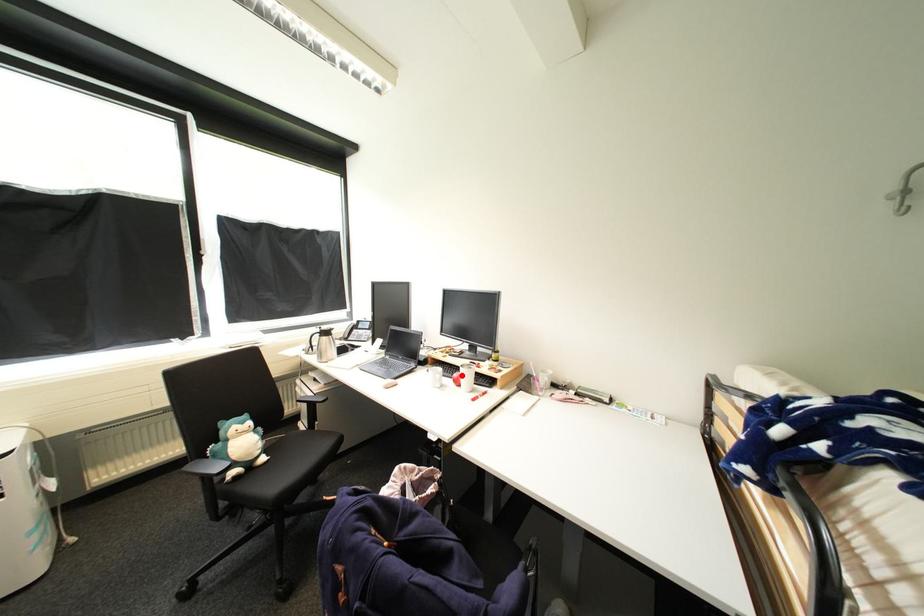
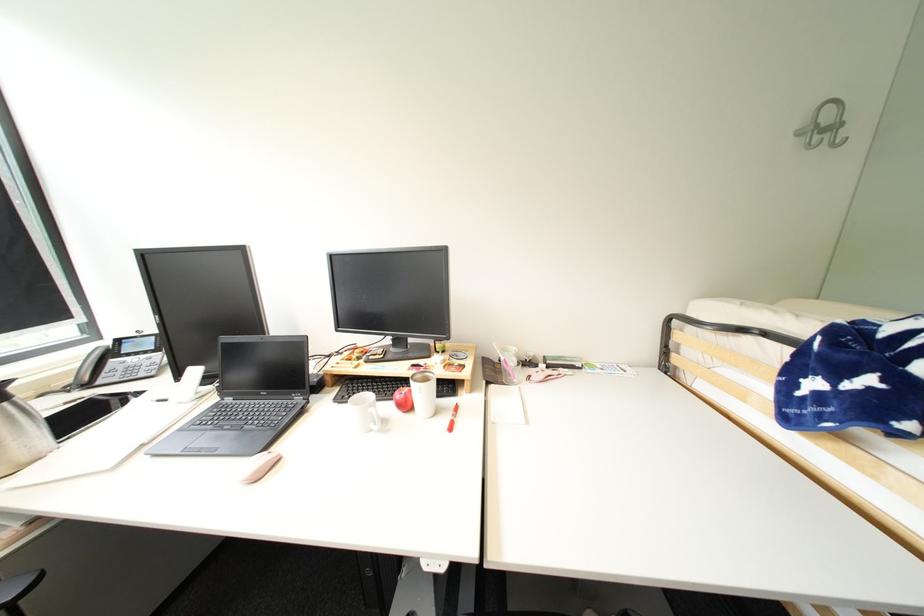
In the second image, find the point that corresponds to the highlighted location in the first image.

(405, 397)